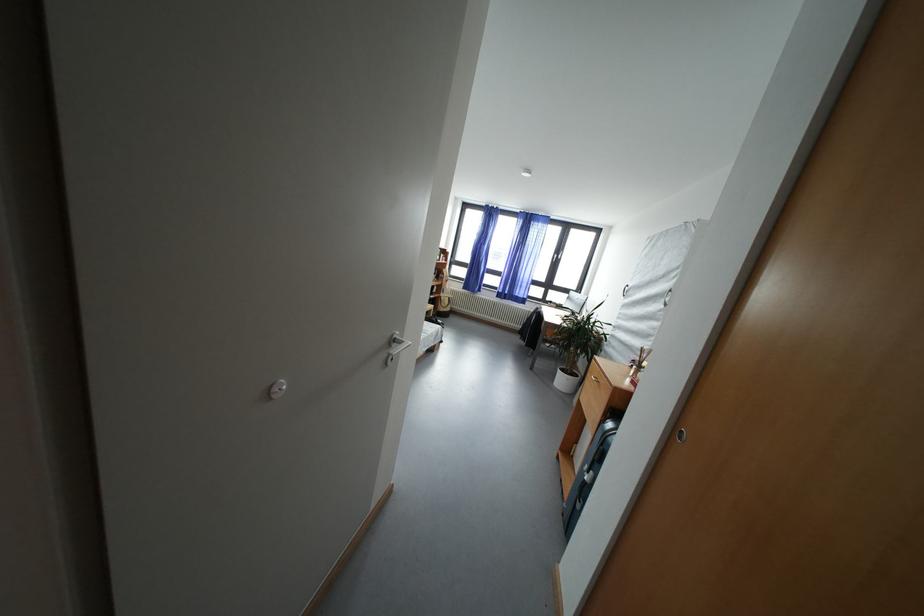
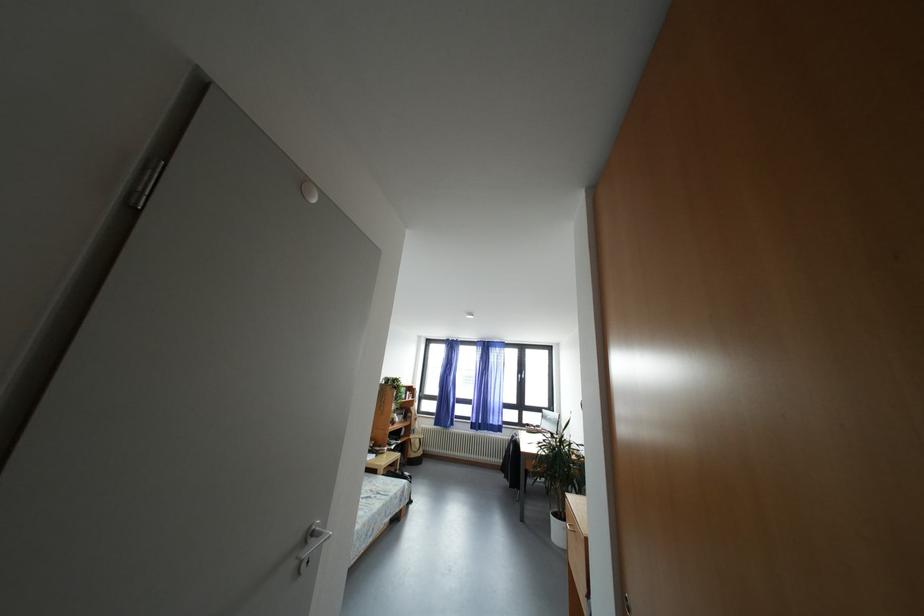
In the second image, find the point that corresponds to the point at 402,345 in the first image.

(320, 539)